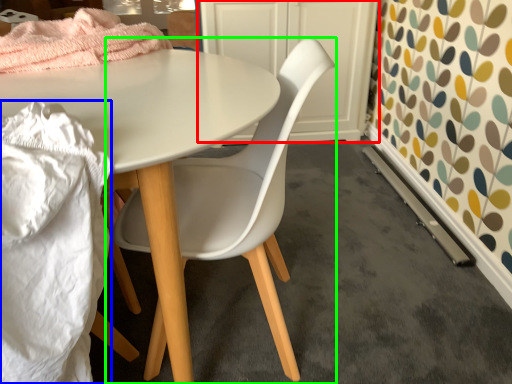
Question: Which is nearer to the cabinetry (highlighted by a red box)? material (highlighted by a blue box) or chair (highlighted by a green box).

Choices:
 (A) material
 (B) chair

Answer: (B)